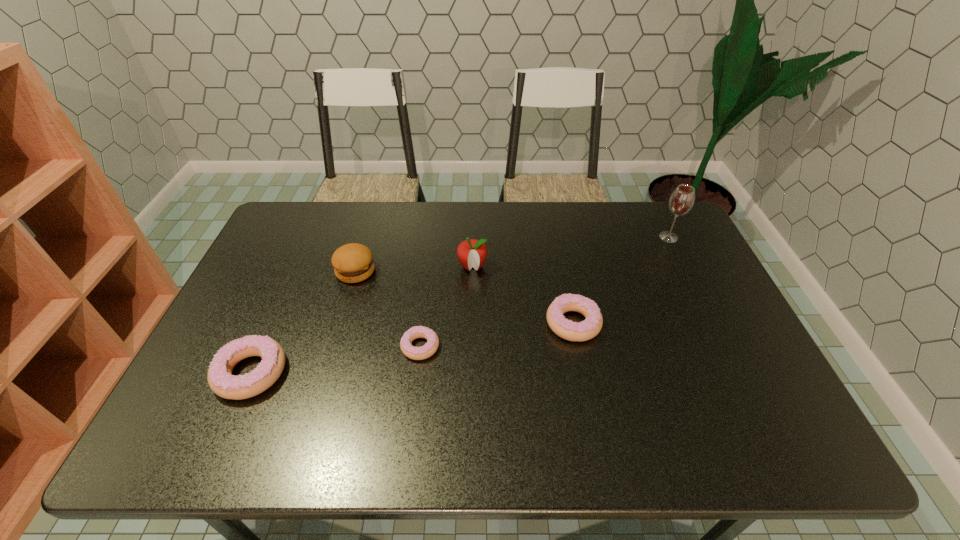
This screenshot has height=540, width=960. What are the coordinates of `vacant space that satisfies the following two spatial constraints: 1. on the back side of the hamburger; 2. on the right side of the fourth object from left to right` in the screenshot? It's located at pos(357,266).

This screenshot has height=540, width=960. What are the coordinates of `free point that satisfies the following two spatial constraints: 1. on the back side of the second shortest doughnut; 2. on the left side of the wineglass` in the screenshot? It's located at (557, 237).

In order to click on vacant area in the image that satisfies the following two spatial constraints: 1. on the back side of the tallest object; 2. on the right side of the rightmost doughnut in this screenshot , I will do `click(557, 237)`.